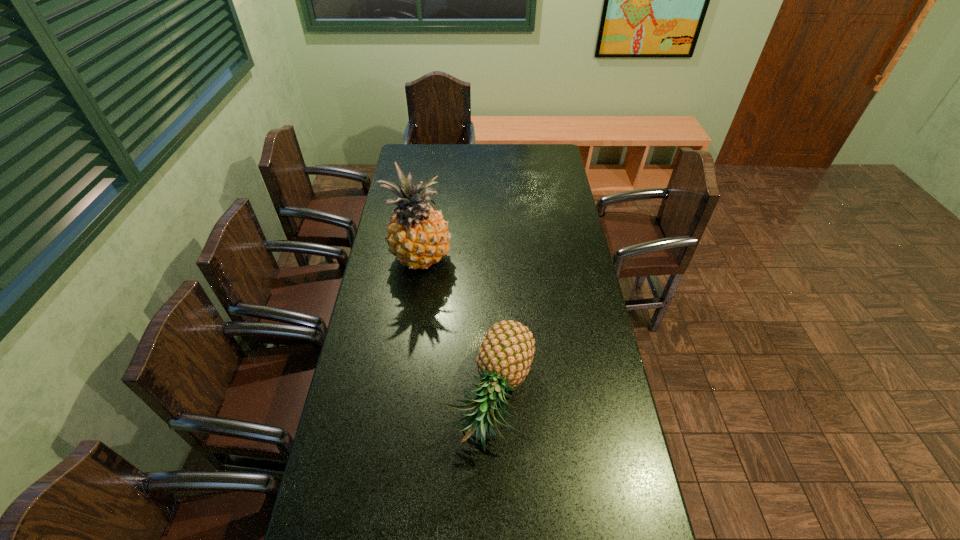
You are a GUI agent. You are given a task and a screenshot of the screen. Output one action in this format:
    pyautogui.click(x=<x>, y=<y>)
    Task: Click on the farther pineapple
    
    Given the screenshot: What is the action you would take?
    pyautogui.click(x=418, y=236)

Locate an element on the screen. The height and width of the screenshot is (540, 960). the farther object is located at coordinates (418, 236).

Find the location of `the shorter object`. the shorter object is located at coordinates (506, 353).

Locate an element on the screen. Image resolution: width=960 pixels, height=540 pixels. the right object is located at coordinates (506, 353).

Identify the location of free space located on the back of the left object. (429, 199).

Locate an element on the screen. The image size is (960, 540). vacant space located 0.230m on the back of the nearer pineapple is located at coordinates (490, 292).

You are a GUI agent. You are given a task and a screenshot of the screen. Output one action in this format:
    pyautogui.click(x=<x>, y=<y>)
    Task: Click on the object that is at the left edge
    This screenshot has height=540, width=960.
    Given the screenshot: What is the action you would take?
    pyautogui.click(x=418, y=236)

Identify the location of free location at the left edge. (390, 212).

The image size is (960, 540). In order to click on vacant space at the right edge in this screenshot , I will do `click(603, 429)`.

In the image, there is a desktop. Where is `vacant space at the far left corner`? This screenshot has width=960, height=540. vacant space at the far left corner is located at coordinates (415, 164).